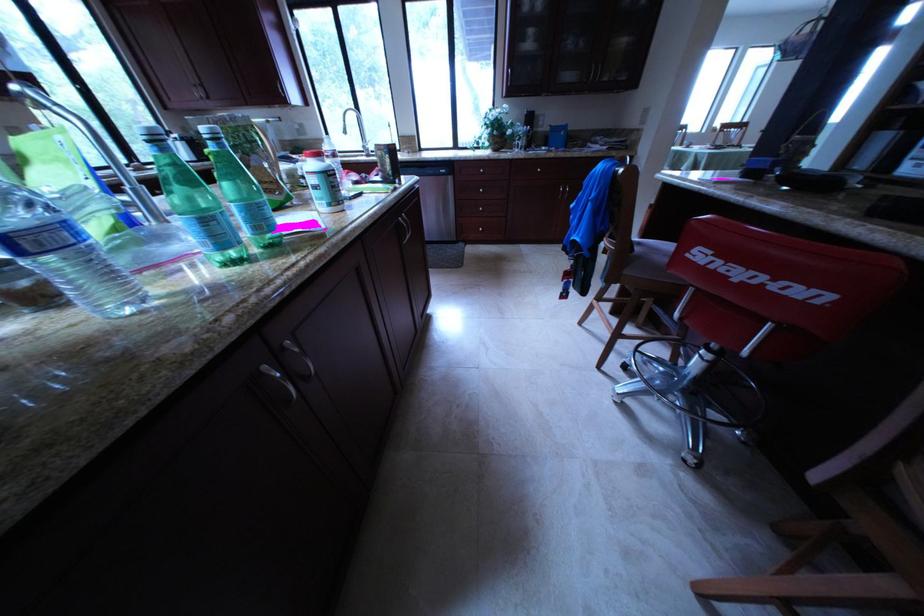
Locate an element on the screen. wooden chair sitting surface is located at coordinates (650, 252).